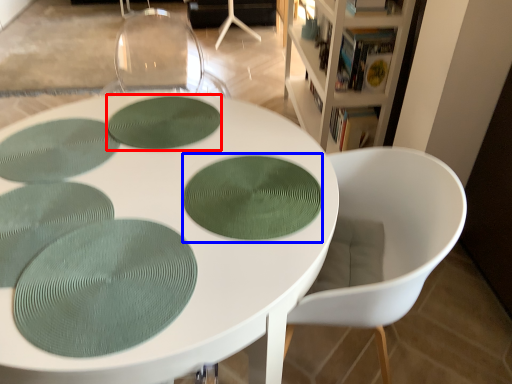
Question: Which of the following is the farthest to the observer, oval (highlighted by a red box) or oval (highlighted by a blue box)?

Choices:
 (A) oval
 (B) oval

Answer: (A)